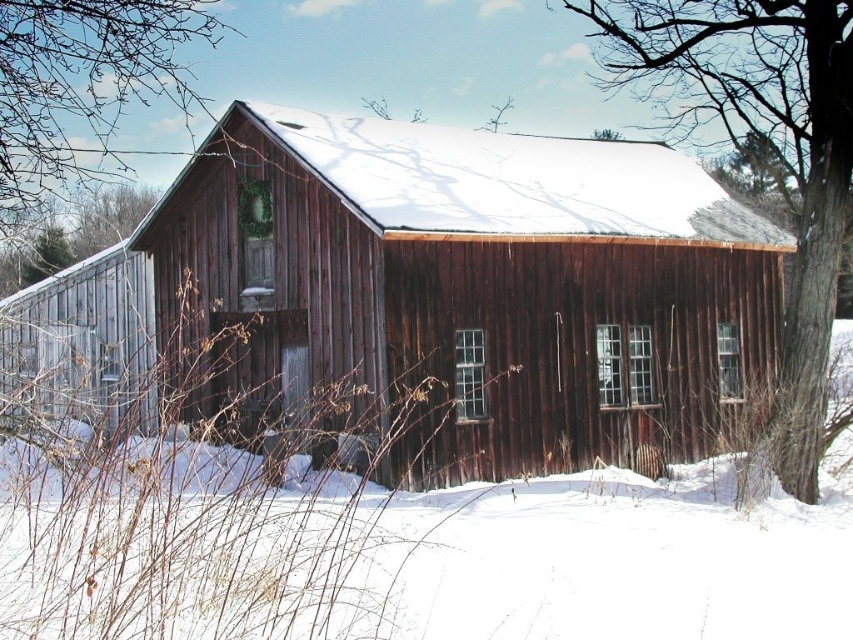
Question: Which object appears farthest from the camera in this image?

Choices:
 (A) brown wood tree at upper left
 (B) rustic wood cabin at center

Answer: (B)

Question: Is rustic wood cabin at center bigger than smooth bark tree at right?

Choices:
 (A) no
 (B) yes

Answer: (A)

Question: Which point is closer to the camera?

Choices:
 (A) (334, 211)
 (B) (65, 10)
 (C) (822, 56)

Answer: (B)

Question: From the image, what is the correct spatial relationship of rustic wood cabin at center in relation to brown wood tree at upper left?

Choices:
 (A) above
 (B) below

Answer: (B)

Question: Estimate the real-world distances between objects in this image. Which object is farther from the smooth bark tree at right?

Choices:
 (A) rustic wood cabin at center
 (B) brown wood tree at upper left

Answer: (B)

Question: Is smooth bark tree at right positioned in front of brown wood tree at upper left?

Choices:
 (A) yes
 (B) no

Answer: (B)